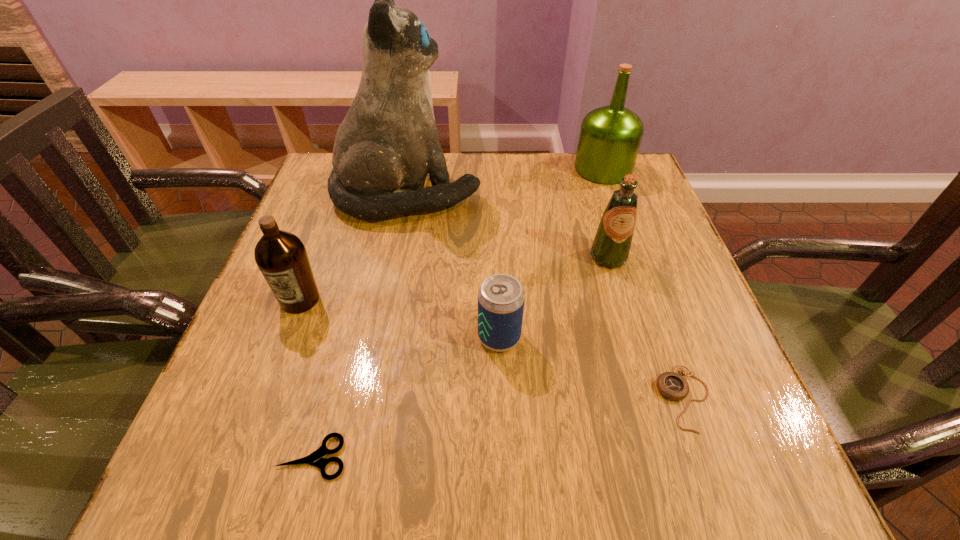
The image size is (960, 540). Identify the location of olive oil positioned at the far edge. (610, 136).

Identify the location of pocket watch at the near edge. (673, 386).

At what (x,y) coordinates should I click in order to perform the action: click on shears positioned at the near edge. Please return your answer as a coordinate pair (x, y). Looking at the image, I should click on (315, 459).

At what (x,y) coordinates should I click in order to perform the action: click on cat positioned at the left edge. Please return your answer as a coordinate pair (x, y). The width and height of the screenshot is (960, 540). Looking at the image, I should click on (388, 142).

Identify the location of olive oil positioned at the left edge. The width and height of the screenshot is (960, 540). click(281, 256).

Image resolution: width=960 pixels, height=540 pixels. I want to click on shears located in the left edge section of the desktop, so click(x=315, y=459).

At what (x,y) coordinates should I click in order to perform the action: click on pocket watch situated at the right edge. Please return your answer as a coordinate pair (x, y). This screenshot has height=540, width=960. Looking at the image, I should click on pos(673,386).

You are a GUI agent. You are given a task and a screenshot of the screen. Output one action in this format:
    pyautogui.click(x=<x>, y=<y>)
    Task: Click on the object at the far left corner
    The width and height of the screenshot is (960, 540).
    Given the screenshot: What is the action you would take?
    pyautogui.click(x=388, y=142)

The width and height of the screenshot is (960, 540). I want to click on object situated at the near left corner, so pos(315,459).

Identify the location of object that is at the far right corner. (610, 136).